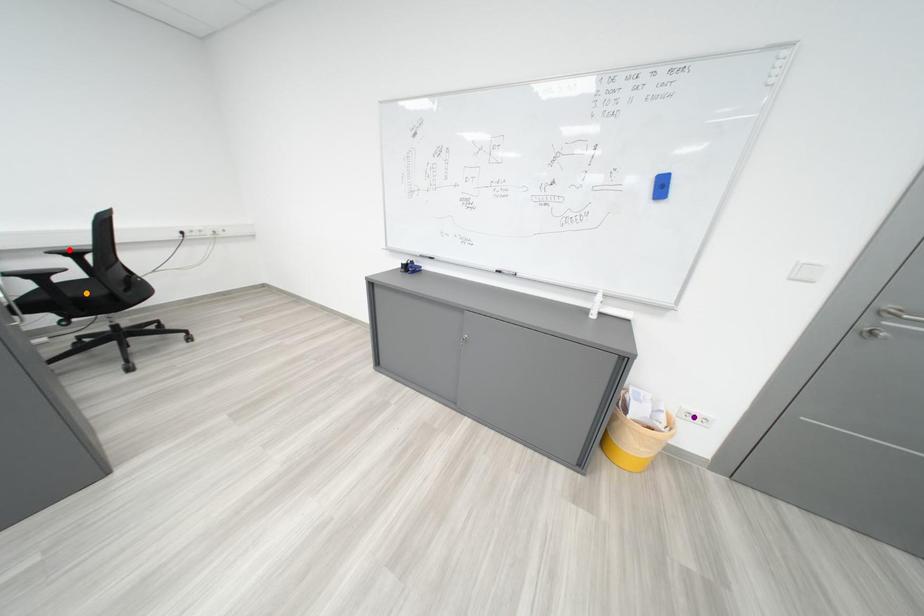
Order these from nearest to farthest:
orange point
red point
purple point

orange point
purple point
red point